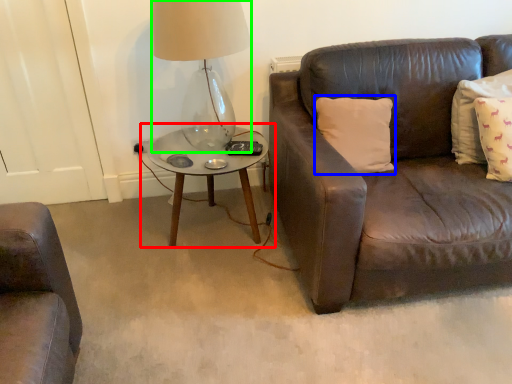
Question: Which is farther away from coffee table (highlighted by a red box)? pillow (highlighted by a blue box) or table lamp (highlighted by a green box)?

Choices:
 (A) pillow
 (B) table lamp

Answer: (A)